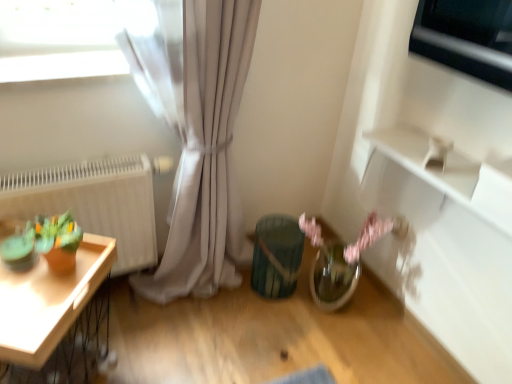
This screenshot has width=512, height=384. What do you see at coordinates (93, 203) in the screenshot?
I see `white matte radiator at left` at bounding box center [93, 203].

This screenshot has width=512, height=384. Find the location of `teal textured vase at center`. teal textured vase at center is located at coordinates (276, 256).

What's the angular difference between teal textured vase at center and wooden tray at left's facing directions?

The angle between the facing direction of teal textured vase at center and the facing direction of wooden tray at left is 54 degrees.

Is teal textured vase at center at the left side of wooden tray at left?

No.

Measure the distance between teal textured vase at center and wooden tray at left.

A distance of 29.57 inches exists between teal textured vase at center and wooden tray at left.

Considering the positions of points (251, 285) and (15, 325), is point (251, 285) farther from camera compared to point (15, 325)?

Yes, point (251, 285) is behind point (15, 325).

From a real-world perspective, is metallic silver window at upper right located beneath teal textured vase at center?

No, from a real-world perspective, metallic silver window at upper right is not under teal textured vase at center.

In the image, is metallic silver window at upper right positioned in front of or behind teal textured vase at center?

metallic silver window at upper right is in front of teal textured vase at center.

From the image's perspective, is metallic silver window at upper right on top of teal textured vase at center?

Yes, from the image's perspective, metallic silver window at upper right is on top of teal textured vase at center.

Is metallic silver window at upper right positioned with its back to teal textured vase at center?

No, metallic silver window at upper right is not facing away from teal textured vase at center.

How many degrees apart are the facing directions of white matte radiator at left and wooden tray at left?

The angle between the facing direction of white matte radiator at left and the facing direction of wooden tray at left is 54.1 degrees.

Are white matte radiator at left and wooden tray at left beside each other?

No, white matte radiator at left is not in contact with wooden tray at left.

Is white matte radiator at left located outside wooden tray at left?

white matte radiator at left is positioned outside wooden tray at left.

Can you confirm if white matte radiator at left is bigger than wooden tray at left?

No, white matte radiator at left is not bigger than wooden tray at left.

Is metallic silver window at upper right in contact with white matte radiator at left?

There is a gap between metallic silver window at upper right and white matte radiator at left.

Identify the location of radiator lying below the metallic silver window at upper right (from the image's perspective). The image size is (512, 384). (93, 203).

Considering the relative positions of metallic silver window at upper right and white matte radiator at left in the image provided, is metallic silver window at upper right to the left of white matte radiator at left from the viewer's perspective?

In fact, metallic silver window at upper right is to the right of white matte radiator at left.

Looking at this image, how many degrees apart are the facing directions of metallic silver window at upper right and white matte radiator at left?

The angle between the facing direction of metallic silver window at upper right and the facing direction of white matte radiator at left is 89.9 degrees.

I want to click on radiator behind the metallic silver window at upper right, so click(x=93, y=203).

Is white matte radiator at left closer to camera compared to metallic silver window at upper right?

No, white matte radiator at left is behind metallic silver window at upper right.

Consider the image. Does white matte radiator at left have a lesser height compared to metallic silver window at upper right?

In fact, white matte radiator at left may be taller than metallic silver window at upper right.

Can you tell me how much white matte radiator at left and metallic silver window at upper right differ in facing direction?

white matte radiator at left and metallic silver window at upper right are facing 89.9 degrees away from each other.

Who is shorter, teal textured vase at center or white matte radiator at left?

Standing shorter between the two is teal textured vase at center.

Are teal textured vase at center and white matte radiator at left beside each other?

No, teal textured vase at center is not touching white matte radiator at left.

How many degrees apart are the facing directions of teal textured vase at center and white matte radiator at left?

The angle between the facing direction of teal textured vase at center and the facing direction of white matte radiator at left is 0.0868 degrees.

Between teal textured vase at center and white matte radiator at left, which one has smaller width?

white matte radiator at left.

Which object is positioned more to the right, wooden tray at left or teal textured vase at center?

Positioned to the right is teal textured vase at center.

Is wooden tray at left taller or shorter than teal textured vase at center?

Clearly, wooden tray at left is taller compared to teal textured vase at center.

Can you tell me how much wooden tray at left and teal textured vase at center differ in facing direction?

There is a 54-degree angle between the facing directions of wooden tray at left and teal textured vase at center.

Is wooden tray at left thinner than teal textured vase at center?

No, wooden tray at left is not thinner than teal textured vase at center.

At what (x,y) coordinates should I click in order to perform the action: click on vase below the wooden tray at left (from a real-world perspective). Please return your answer as a coordinate pair (x, y). The image size is (512, 384). Looking at the image, I should click on (276, 256).

You are a GUI agent. You are given a task and a screenshot of the screen. Output one action in this format:
    pyautogui.click(x=<x>, y=<y>)
    Task: Click on the appliance above the teal textured vase at center (from the image's perspective)
    
    Given the screenshot: What is the action you would take?
    pyautogui.click(x=467, y=37)

Looking at the image, which one is located further to teal textured vase at center, wooden tray at left or white matte radiator at left?

Based on the image, wooden tray at left appears to be further to teal textured vase at center.

Which object lies further to the anchor point metallic silver window at upper right, teal textured vase at center or white matte radiator at left?

white matte radiator at left is positioned further to the anchor metallic silver window at upper right.

Considering their positions, is metallic silver window at upper right positioned closer to wooden tray at left than white matte radiator at left?

white matte radiator at left is positioned closer to the anchor wooden tray at left.

When comparing their distances from metallic silver window at upper right, does wooden tray at left or teal textured vase at center seem closer?

teal textured vase at center is closer to metallic silver window at upper right.

Estimate the real-world distances between objects in this image. Which object is further from teal textured vase at center, wooden tray at left or metallic silver window at upper right?

metallic silver window at upper right is positioned further to the anchor teal textured vase at center.

When comparing their distances from white matte radiator at left, does wooden tray at left or metallic silver window at upper right seem further?

metallic silver window at upper right.

Looking at the image, which one is located closer to metallic silver window at upper right, white matte radiator at left or teal textured vase at center?

Based on the image, teal textured vase at center appears to be nearer to metallic silver window at upper right.

From the image, which object appears to be nearer to metallic silver window at upper right, white matte radiator at left or wooden tray at left?

The object closer to metallic silver window at upper right is white matte radiator at left.

Locate an element on the screen. This screenshot has height=384, width=512. radiator between wooden tray at left and metallic silver window at upper right in the horizontal direction is located at coordinates (93, 203).

Find the location of a particular element. The height and width of the screenshot is (384, 512). radiator between wooden tray at left and teal textured vase at center is located at coordinates (93, 203).

Identify the location of vase between white matte radiator at left and metallic silver window at upper right in the horizontal direction. [276, 256].

At what (x,y) coordinates should I click in order to perform the action: click on vase between wooden tray at left and metallic silver window at upper right from left to right. Please return your answer as a coordinate pair (x, y). Looking at the image, I should click on (276, 256).